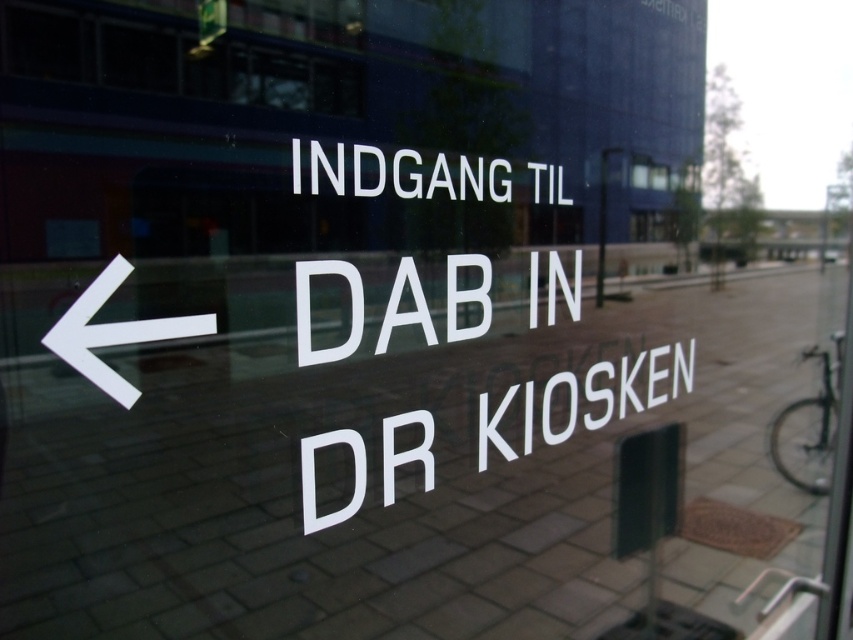
Question: Can you confirm if white text at center is positioned above transparent glass window at upper center?

Choices:
 (A) yes
 (B) no

Answer: (B)

Question: Can you confirm if white glossy text at center is thinner than white glossy arrow at left?

Choices:
 (A) no
 (B) yes

Answer: (A)

Question: Can you confirm if white glossy text at center is thinner than transparent glass window at upper center?

Choices:
 (A) no
 (B) yes

Answer: (A)

Question: Which point is closer to the camera?

Choices:
 (A) (643, 164)
 (B) (398, 289)

Answer: (B)

Question: Which point is closer to the camera?

Choices:
 (A) (659, 378)
 (B) (660, 168)

Answer: (B)

Question: Based on their relative distances, which object is nearer to the white glossy text at center?

Choices:
 (A) white matte text at center
 (B) white glossy arrow at left
 (C) transparent glass window at upper center

Answer: (A)